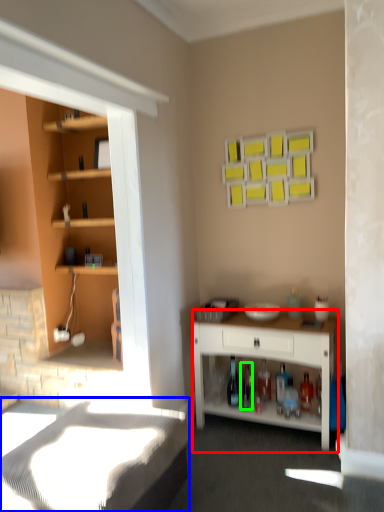
Question: Considering the real-world distances, which object is farthest from desk (highlighted by a red box)? bed frame (highlighted by a blue box) or bottle (highlighted by a green box)?

Choices:
 (A) bed frame
 (B) bottle

Answer: (A)